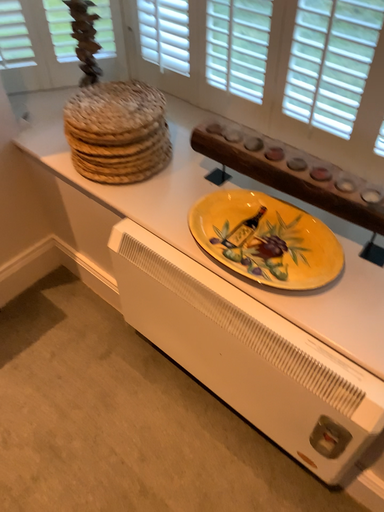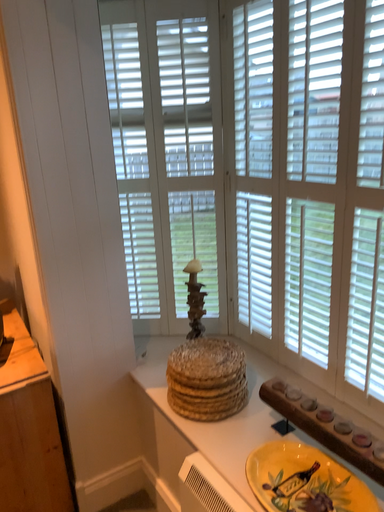
Question: How did the camera likely rotate when shooting the video?

Choices:
 (A) rotated left
 (B) rotated right

Answer: (A)